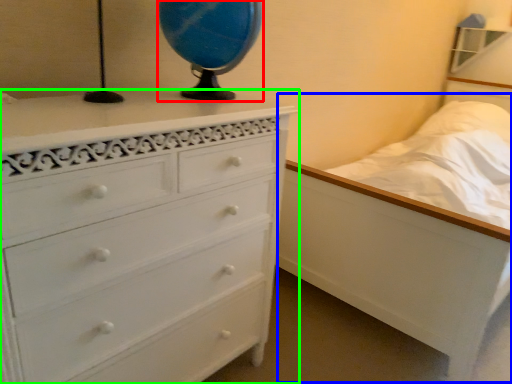
Question: Which object is the closest to the table lamp (highlighted by a red box)? Choose among these: bed (highlighted by a blue box) or chest of drawers (highlighted by a green box).

Choices:
 (A) bed
 (B) chest of drawers

Answer: (B)